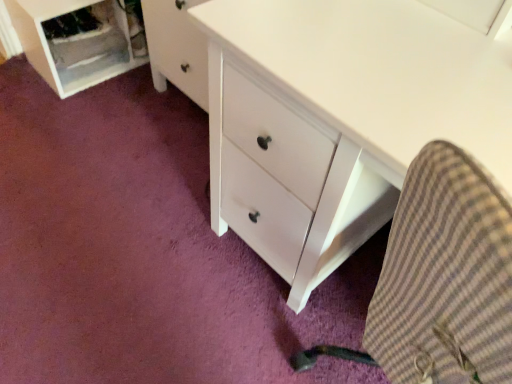
Question: Should I look upward or downward to see brown checkered fabric at lower right?

Choices:
 (A) down
 (B) up

Answer: (A)

Question: From the image's perspective, is white plastic file cabinet at lower left beneath brown checkered fabric at lower right?

Choices:
 (A) yes
 (B) no

Answer: (B)

Question: Does white plastic file cabinet at lower left have a lesser width compared to brown checkered fabric at lower right?

Choices:
 (A) no
 (B) yes

Answer: (B)

Question: Is white plastic file cabinet at lower left turned away from brown checkered fabric at lower right?

Choices:
 (A) yes
 (B) no

Answer: (B)

Question: From the image's perspective, is white plastic file cabinet at lower left on top of brown checkered fabric at lower right?

Choices:
 (A) no
 (B) yes

Answer: (B)

Question: From a real-world perspective, is white plastic file cabinet at lower left under brown checkered fabric at lower right?

Choices:
 (A) no
 (B) yes

Answer: (B)

Question: Would you consider white plastic file cabinet at lower left to be distant from brown checkered fabric at lower right?

Choices:
 (A) no
 (B) yes

Answer: (B)

Question: Is white plastic file cabinet at lower left inside brown checkered fabric at lower right?

Choices:
 (A) no
 (B) yes

Answer: (A)

Question: From the image's perspective, does brown checkered fabric at lower right appear higher than white plastic file cabinet at lower left?

Choices:
 (A) yes
 (B) no

Answer: (B)

Question: Can you confirm if brown checkered fabric at lower right is wider than white plastic file cabinet at lower left?

Choices:
 (A) yes
 (B) no

Answer: (A)

Question: Considering the relative positions of brown checkered fabric at lower right and white plastic file cabinet at lower left in the image provided, is brown checkered fabric at lower right to the right of white plastic file cabinet at lower left from the viewer's perspective?

Choices:
 (A) no
 (B) yes

Answer: (B)

Question: Is brown checkered fabric at lower right bigger than white plastic file cabinet at lower left?

Choices:
 (A) yes
 (B) no

Answer: (A)

Question: Is brown checkered fabric at lower right to the left of white plastic file cabinet at lower left from the viewer's perspective?

Choices:
 (A) yes
 (B) no

Answer: (B)

Question: In terms of width, does brown checkered fabric at lower right look wider or thinner when compared to white plastic file cabinet at lower left?

Choices:
 (A) wide
 (B) thin

Answer: (A)